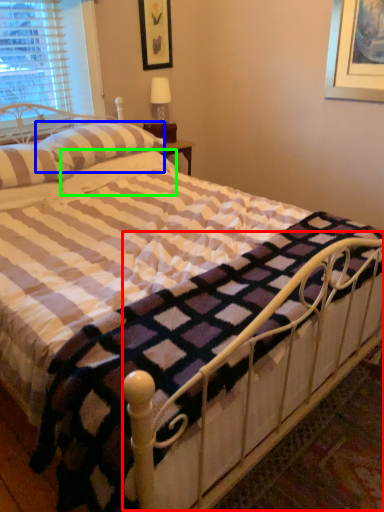
Question: Which object is the closest to the balustrade (highlighted by a red box)? Choose among these: pillow (highlighted by a blue box) or pillow (highlighted by a green box).

Choices:
 (A) pillow
 (B) pillow

Answer: (B)